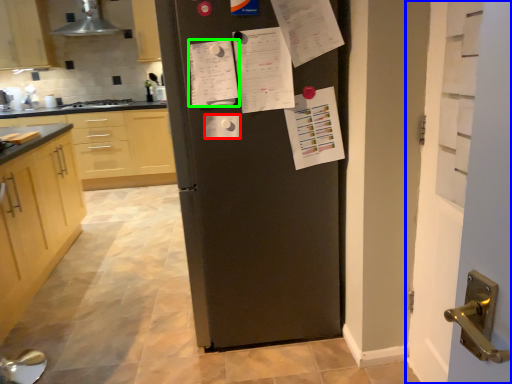
Question: Which object is the farthest from paper (highlighted by a red box)? Choose among these: door (highlighted by a blue box) or list (highlighted by a green box).

Choices:
 (A) door
 (B) list

Answer: (A)